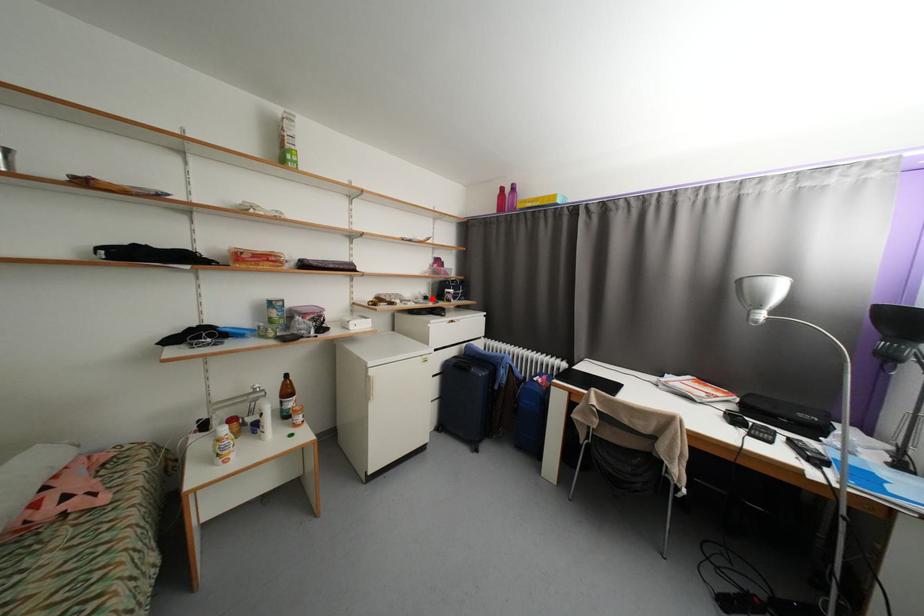
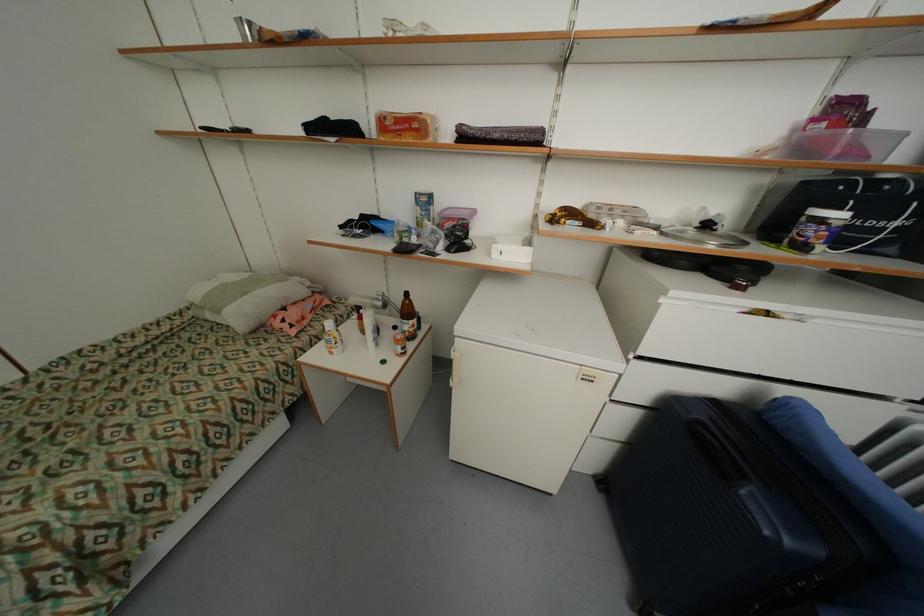
Where in the second image is the point corresponding to the highlighted location from the first image?

(713, 227)